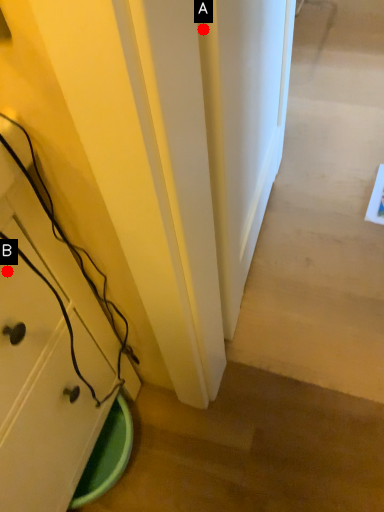
Question: Two points are circled on the image, labeled by A and B beside each circle. Which of the following is the closest to the observer?

Choices:
 (A) A is closer
 (B) B is closer

Answer: (A)